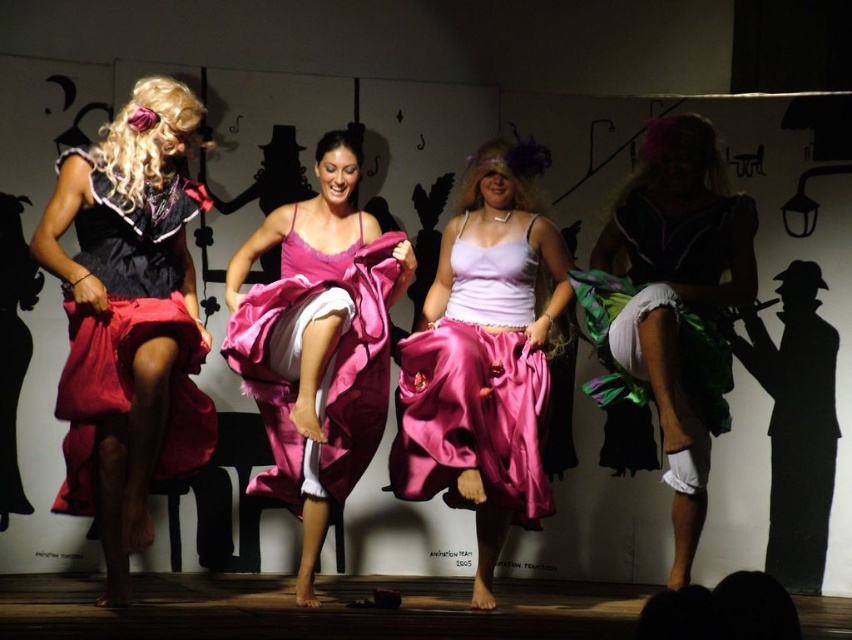
Question: Based on their relative distances, which object is nearer to the matte black dress at left?

Choices:
 (A) matte black dress at right
 (B) satin pink dress at center

Answer: (B)

Question: Is matte black dress at left to the right of pink satin skirt at center from the viewer's perspective?

Choices:
 (A) no
 (B) yes

Answer: (A)

Question: Which of the following is the closest to the observer?

Choices:
 (A) matte black dress at right
 (B) matte black dress at left
 (C) satin pink dress at center
 (D) pink satin skirt at center

Answer: (B)

Question: Is matte black dress at left further to the viewer compared to matte black dress at right?

Choices:
 (A) no
 (B) yes

Answer: (A)

Question: Is matte black dress at left below satin pink dress at center?

Choices:
 (A) yes
 (B) no

Answer: (B)

Question: Among these points, which one is farthest from the camera?

Choices:
 (A) (320, 260)
 (B) (717, 324)
 (C) (487, 268)

Answer: (B)